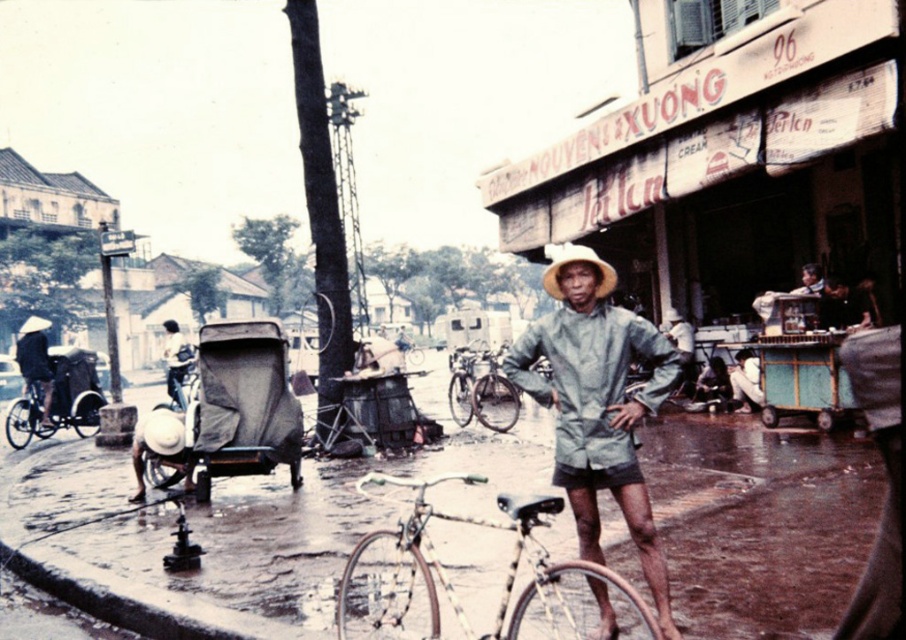
You are a delivery person who needs to secure a package on the silver metallic bicycle at center. The package must be placed above the natural straw hat at center to avoid getting wet from the rain. Is this possible?

The silver metallic bicycle at center is positioned under the natural straw hat at center, so placing the package above the natural straw hat at center would not be possible as the bicycle is already beneath it.